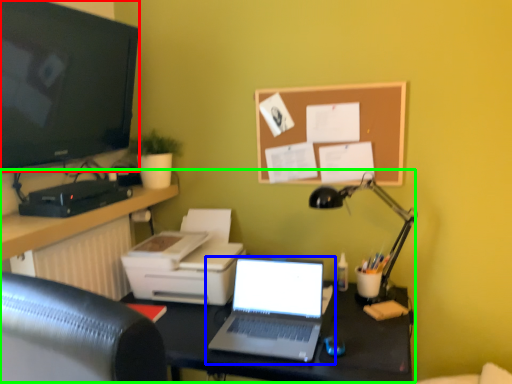
Question: Based on their relative distances, which object is nearer to television (highlighted by a red box)? Choose from laptop (highlighted by a blue box) and entertainment center (highlighted by a green box).

Choices:
 (A) laptop
 (B) entertainment center

Answer: (B)